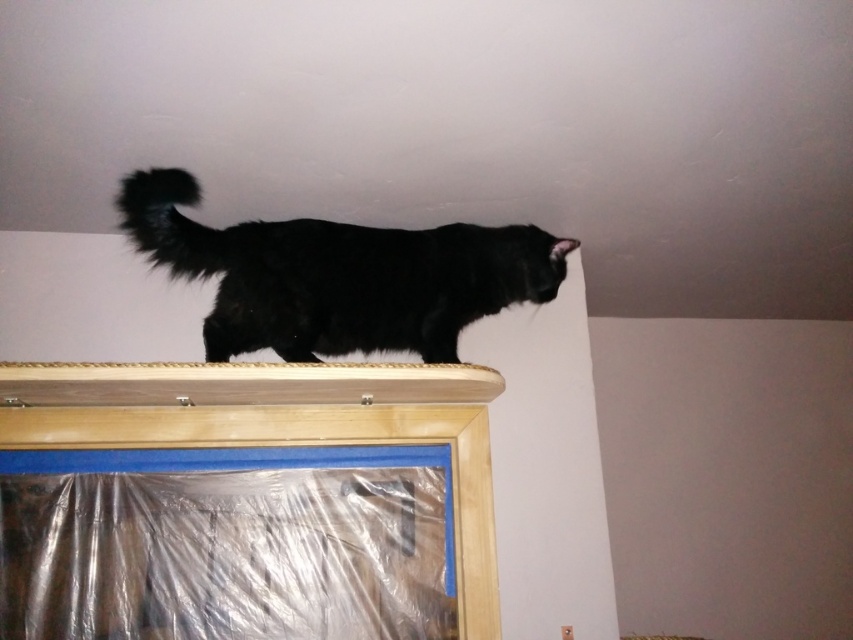
Is point (428, 276) more distant than point (137, 189)?

That is True.

Which is more to the left, black fluffy cat at upper center or fluffy black tail at upper center?

Positioned to the left is fluffy black tail at upper center.

Is point (321, 305) behind point (154, 253)?

That is False.

Locate an element on the screen. black fluffy cat at upper center is located at coordinates (338, 275).